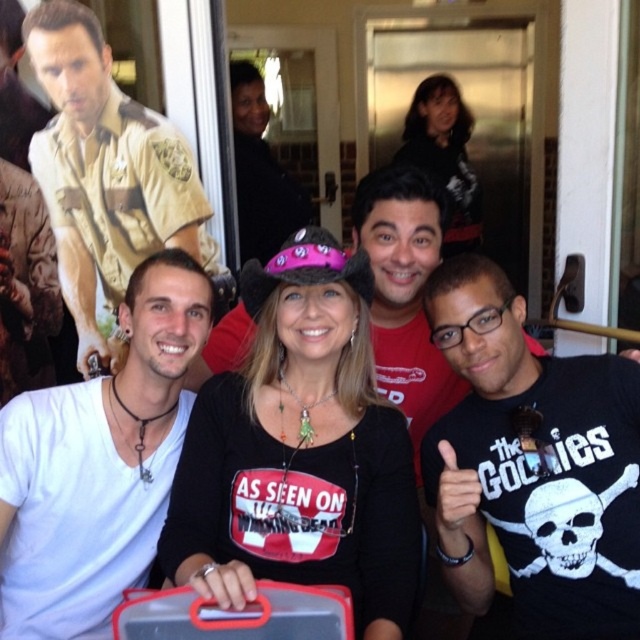
Question: Estimate the real-world distances between objects in this image. Which object is closer to the matte black shirt at center?

Choices:
 (A) white matte shirt at center
 (B) pink fabric hat at center

Answer: (B)

Question: Is white matte shirt at center wider than matte khaki uniform at left?

Choices:
 (A) yes
 (B) no

Answer: (B)

Question: Which of the following is the farthest from the observer?

Choices:
 (A) matte black shirt at center
 (B) pink fabric hat at center
 (C) white matte shirt at center

Answer: (A)

Question: Based on their relative distances, which object is nearer to the matte black shirt at center?

Choices:
 (A) black matte skull t-shirt at center
 (B) pink fabric hat at center

Answer: (A)

Question: Is matte khaki uniform at left further to camera compared to matte black shirt at center?

Choices:
 (A) yes
 (B) no

Answer: (A)

Question: Can you confirm if black matte skull t-shirt at center is positioned to the left of matte khaki uniform at left?

Choices:
 (A) no
 (B) yes

Answer: (A)